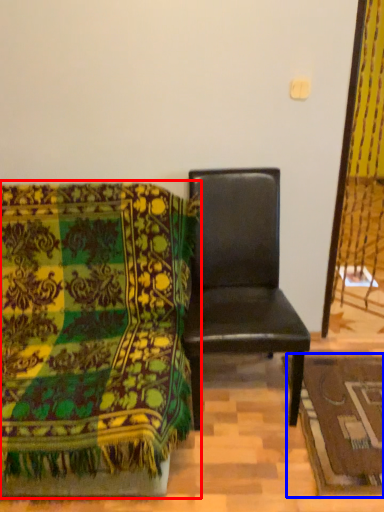
Question: Which of the following is the closest to the observer, chair (highlighted by a red box) or mat (highlighted by a blue box)?

Choices:
 (A) chair
 (B) mat

Answer: (A)